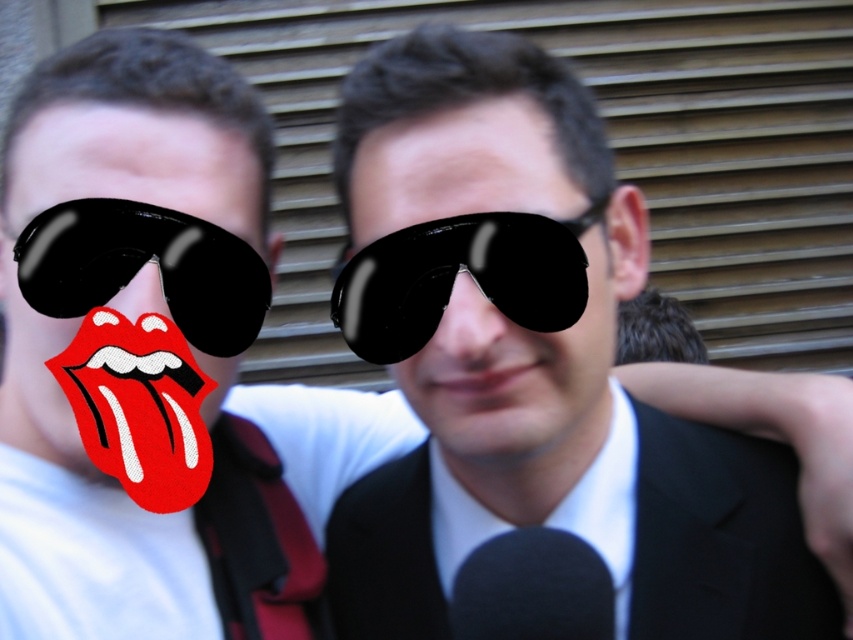
Question: Does pink matte lips at center have a lesser width compared to matte black nose at center?

Choices:
 (A) yes
 (B) no

Answer: (B)

Question: Which object is closer to the camera taking this photo?

Choices:
 (A) red glossy tongue at center
 (B) black matte sunglasses at center
 (C) black glossy sunglasses at center

Answer: (B)

Question: In this image, where is black matte sunglasses at center located relative to pink matte lips at center?

Choices:
 (A) left
 (B) right

Answer: (B)

Question: Can you confirm if red glossy tongue at center is thinner than burgundy satin tie at center?

Choices:
 (A) no
 (B) yes

Answer: (A)

Question: Which point is closer to the camera?

Choices:
 (A) (138, 305)
 (B) (485, 257)

Answer: (B)

Question: Which point is closer to the camera taking this photo?

Choices:
 (A) (300, 589)
 (B) (561, 355)
 (C) (492, 337)

Answer: (C)